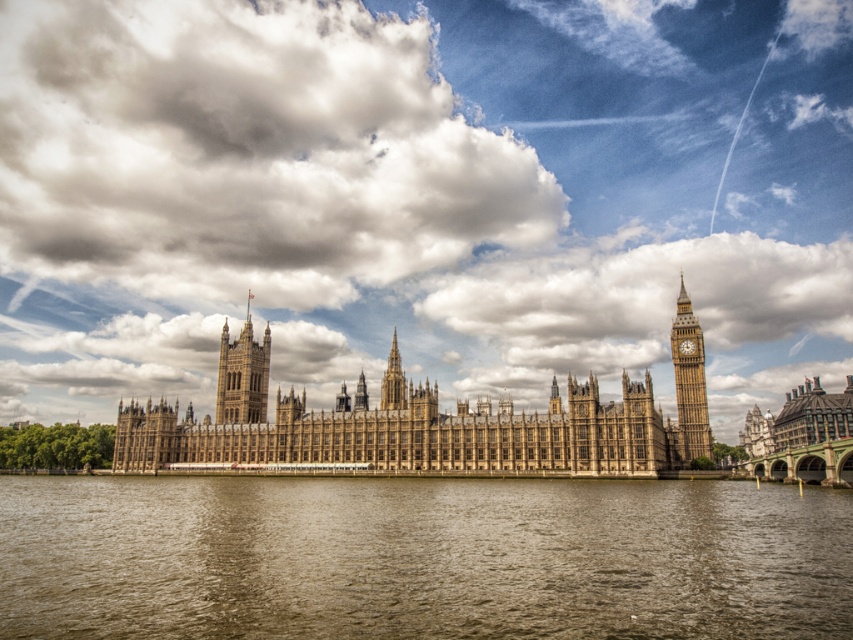
You are an architect analyzing the Palace of Westminster. You notice the cloudy sky at upper center and the brown water at lower center. Which of these two elements has a greater horizontal span in the image?

The cloudy sky at upper center has a greater horizontal span than the brown water at lower center because its width is larger.

You are standing in front of the Palace of Westminster and notice the cloudy sky at upper center and the brown water at lower center. Which object is located to the left when comparing their positions?

The cloudy sky at upper center is positioned on the left side of the brown water at lower center, so it is more to the left.

Based on the photo, you are a tourist standing on the Westminster Bridge and looking at the Palace of Westminster. You see the brown water at lower center and the brown stone tower at center. Which object is closer to the bridge?

The brown water at lower center is closer to the bridge because it is located below the brown stone tower at center.